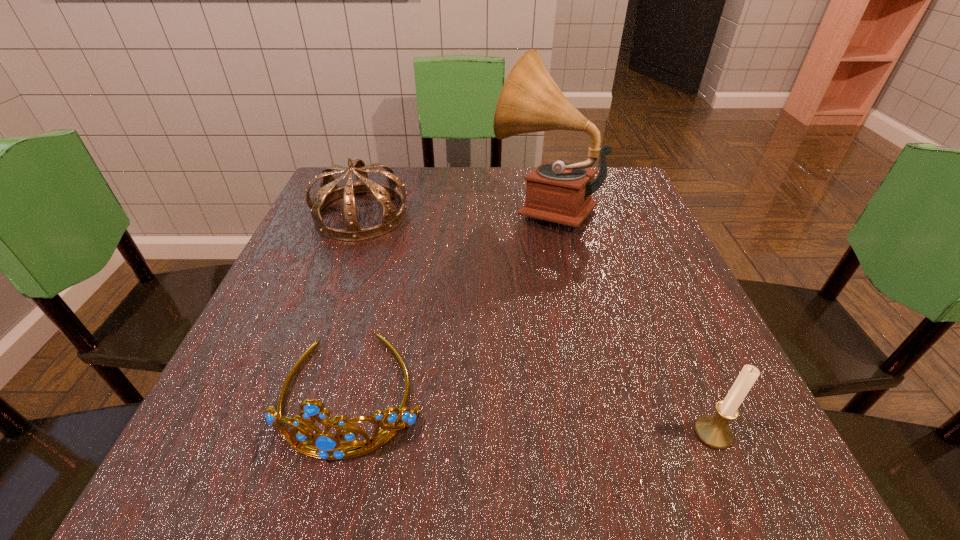
Where is `the third object from left to right`? the third object from left to right is located at coordinates (530, 101).

Find the location of `the tallest object`. the tallest object is located at coordinates (530, 101).

This screenshot has height=540, width=960. I want to click on the farther tiara, so click(x=329, y=191).

This screenshot has width=960, height=540. In order to click on the rightmost object in this screenshot , I will do `click(713, 430)`.

I want to click on the nearer tiara, so click(x=328, y=446).

What are the coordinates of `vacant space located 0.340m on the horn of the phonograph record` in the screenshot? It's located at (347, 206).

Locate an element on the screen. free space located on the horn of the phonograph record is located at coordinates (402, 206).

What are the coordinates of `vacant area situated 0.190m on the horn of the phonograph record` in the screenshot? It's located at (411, 206).

The width and height of the screenshot is (960, 540). What are the coordinates of `free space located 0.150m on the right of the farther tiara` in the screenshot? It's located at (475, 215).

At what (x,y) coordinates should I click in order to perform the action: click on vacant space situated 0.130m on the left of the candle holder. Please return your answer as a coordinate pair (x, y). Image resolution: width=960 pixels, height=540 pixels. Looking at the image, I should click on (599, 433).